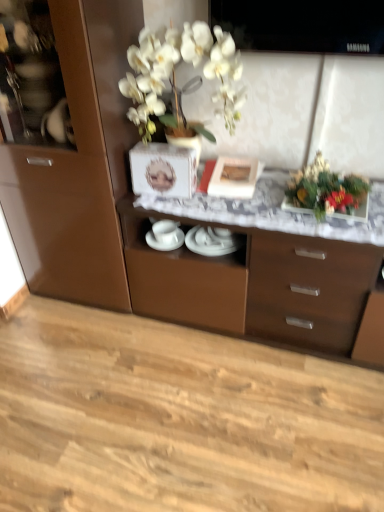
Identify the location of vacant space to the right of matte white picture frame at center. The height and width of the screenshot is (512, 384). (273, 178).